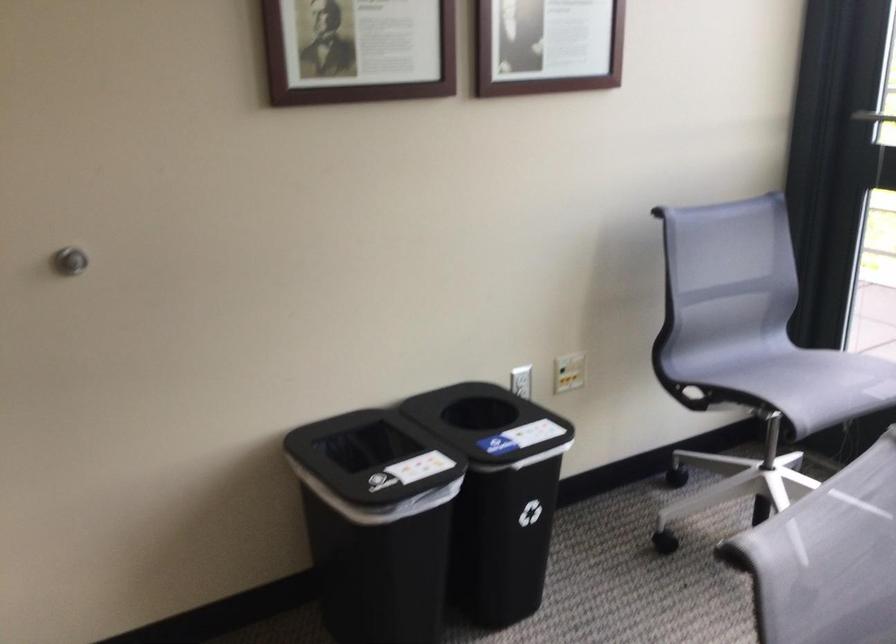
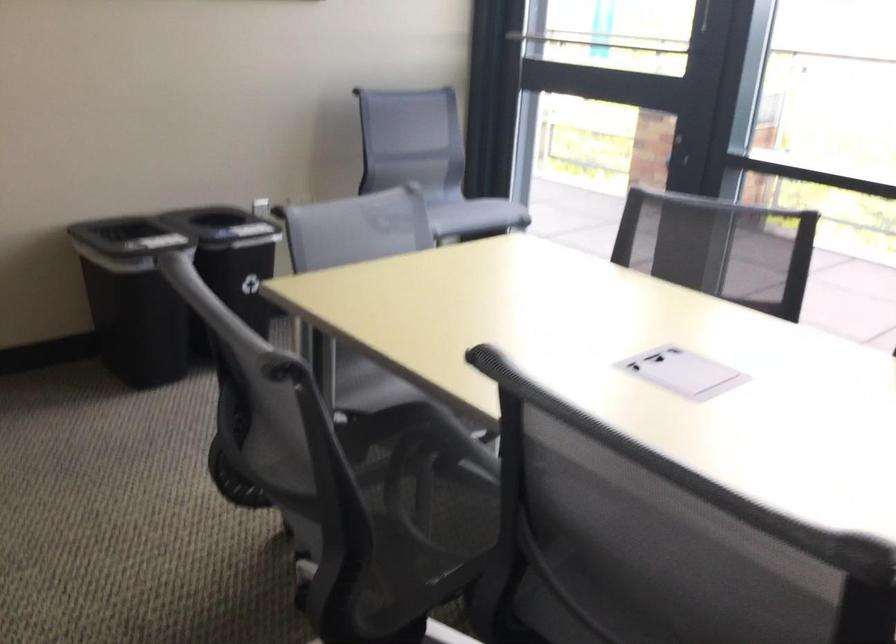
Question: I am providing you with two images of the same scene from different viewpoints. Please identify which objects are invisible in image2.

Choices:
 (A) grey bench sitting surface
 (B) black door handle
 (C) gray chair sitting surface
 (D) chair adjustment lever

Answer: (D)